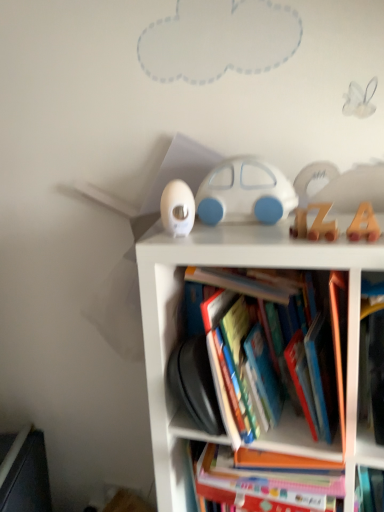
Question: Does hardcover book at center have a smaller size compared to wooden letter at upper center, the 2th toy when ordered from front to back?

Choices:
 (A) yes
 (B) no

Answer: (B)

Question: Is hardcover book at center thinner than wooden letter at upper center, arranged as the third toy when viewed from the back?

Choices:
 (A) no
 (B) yes

Answer: (A)

Question: Is hardcover book at center not close to wooden letter at upper center, the 2th toy when ordered from front to back?

Choices:
 (A) yes
 (B) no

Answer: (B)

Question: From a real-world perspective, is hardcover book at center physically above wooden letter at upper center, arranged as the third toy when viewed from the back?

Choices:
 (A) no
 (B) yes

Answer: (A)

Question: Does hardcover book at center have a lesser height compared to wooden letter at upper center, the 2th toy when ordered from front to back?

Choices:
 (A) yes
 (B) no

Answer: (B)

Question: From the image's perspective, is hardcover book at center under wooden letter at upper center, arranged as the third toy when viewed from the back?

Choices:
 (A) no
 (B) yes

Answer: (B)

Question: Is wooden letter at upper center, arranged as the third toy when viewed from the back, looking in the opposite direction of white matte car at center, placed as the 4th toy when sorted from front to back?

Choices:
 (A) yes
 (B) no

Answer: (B)

Question: Can you confirm if wooden letter at upper center, arranged as the third toy when viewed from the back, is thinner than white matte car at center, positioned as the first toy in back-to-front order?

Choices:
 (A) no
 (B) yes

Answer: (B)

Question: From a real-world perspective, is wooden letter at upper center, arranged as the third toy when viewed from the back, physically below white matte car at center, placed as the 4th toy when sorted from front to back?

Choices:
 (A) no
 (B) yes

Answer: (B)

Question: Is wooden letter at upper center, the 2th toy when ordered from front to back, positioned beyond the bounds of white matte car at center, placed as the 4th toy when sorted from front to back?

Choices:
 (A) no
 (B) yes

Answer: (B)

Question: Is wooden letter at upper center, the 2th toy when ordered from front to back, to the right of white matte car at center, positioned as the first toy in back-to-front order, from the viewer's perspective?

Choices:
 (A) yes
 (B) no

Answer: (A)

Question: Is wooden letter at upper center, the 2th toy when ordered from front to back, to the left of white matte car at center, positioned as the first toy in back-to-front order, from the viewer's perspective?

Choices:
 (A) no
 (B) yes

Answer: (A)

Question: From a real-world perspective, is white plastic bookcase at center positioned over white plastic thermometer at upper left, acting as the second toy starting from the back, based on gravity?

Choices:
 (A) yes
 (B) no

Answer: (B)